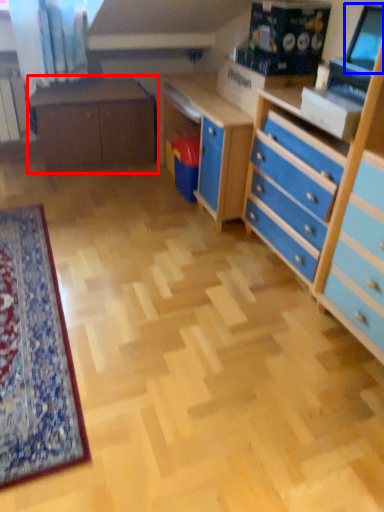
Question: Which of the following is the closest to the observer, table (highlighted by a red box) or computer monitor (highlighted by a blue box)?

Choices:
 (A) table
 (B) computer monitor

Answer: (B)